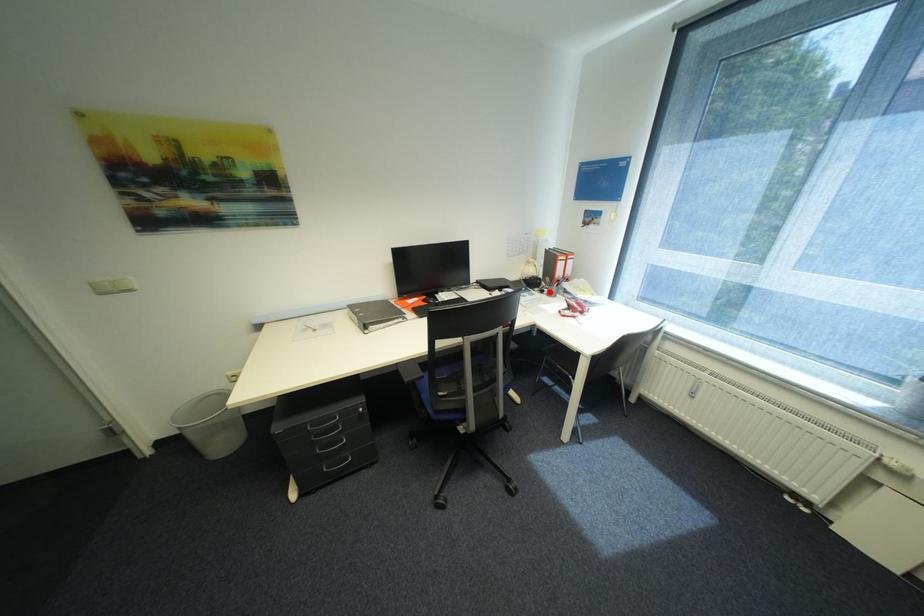
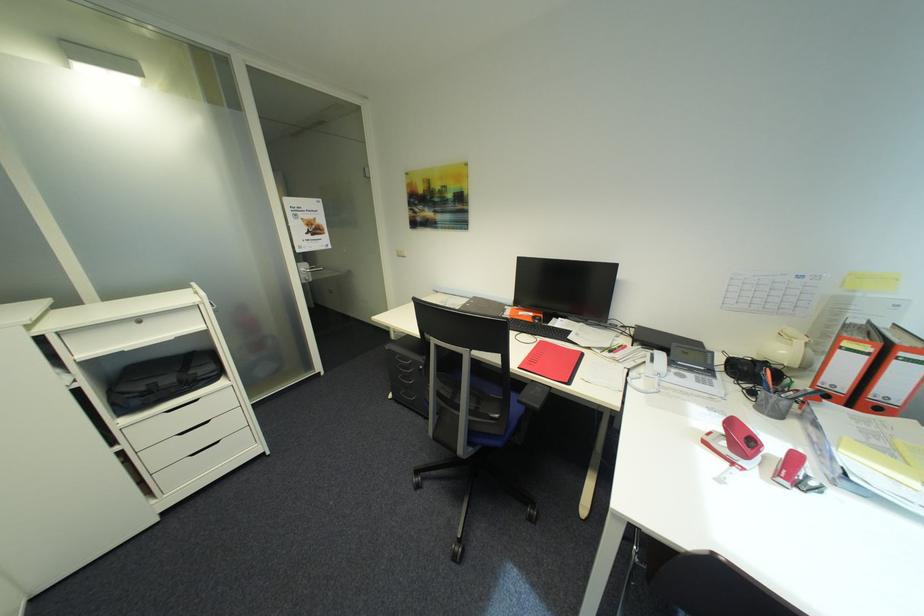
In the second image, find the point that corresponds to the highlighted location in the first image.

(760, 392)